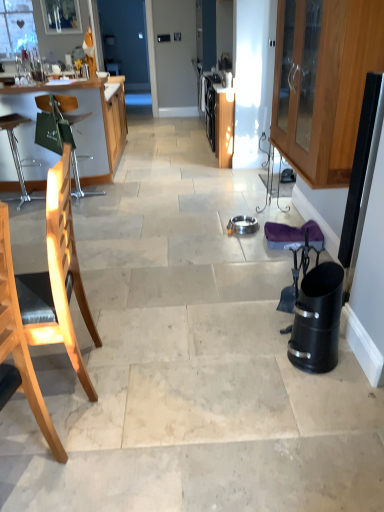
Find the location of a particular element. This screenshot has height=512, width=384. vacant area that lies between light wood chair at left, the 1th chair when ordered from front to back, and black plastic swivel chair at right is located at coordinates (171, 402).